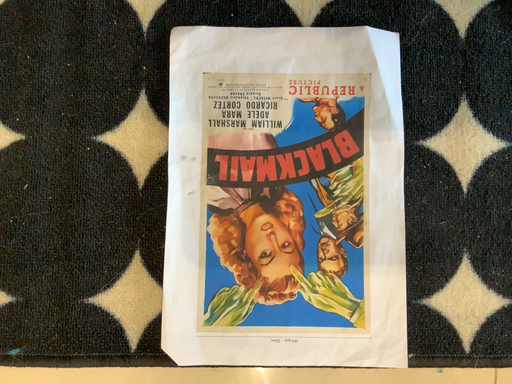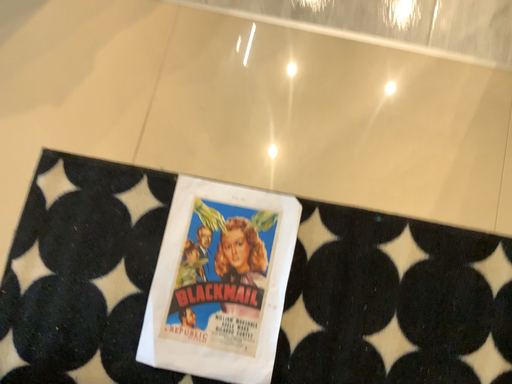
Question: Which way did the camera rotate in the video?

Choices:
 (A) rotated downward
 (B) rotated upward

Answer: (B)